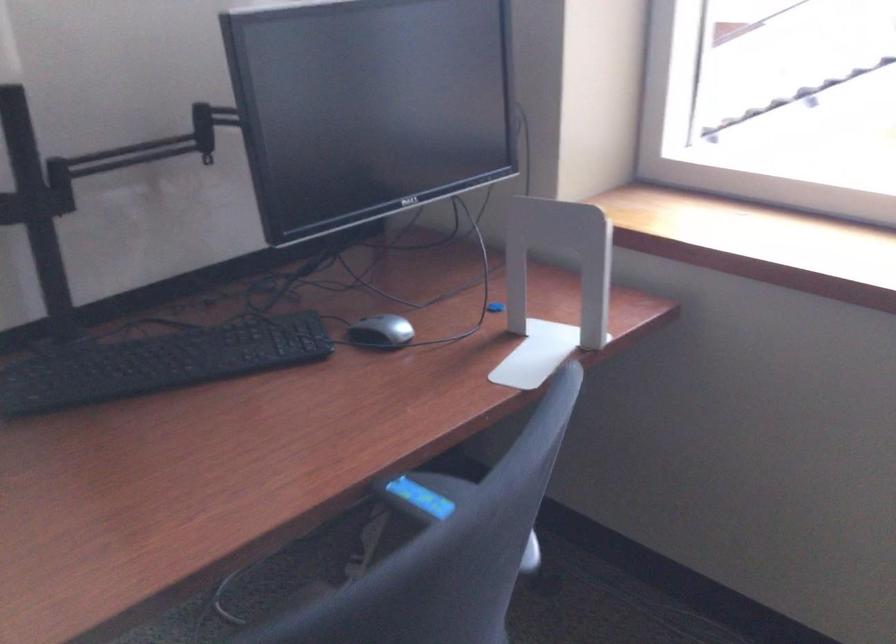
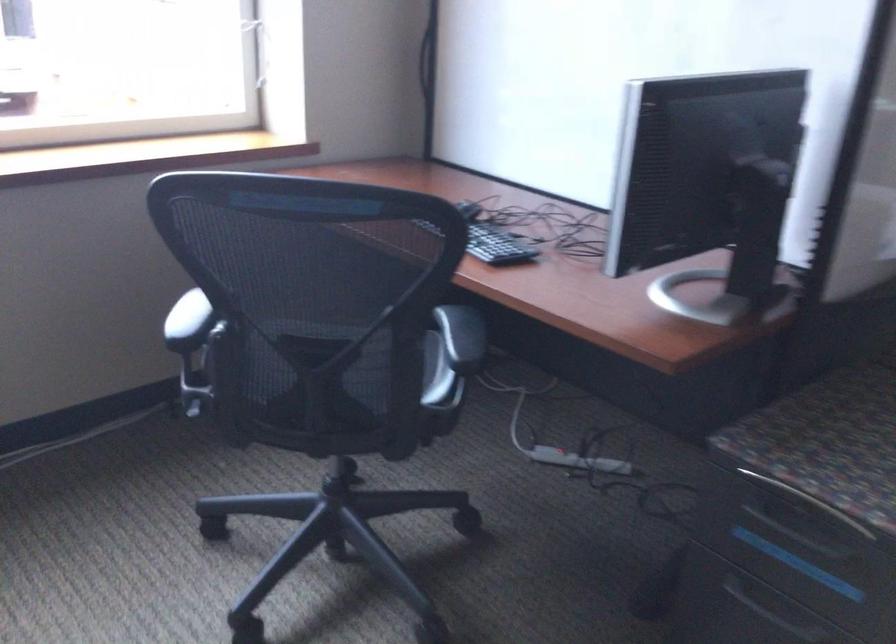
Question: I am providing you with two images of the same scene from different viewpoints. Please identify which objects are invisible in image2.

Choices:
 (A) silver computer mouse
 (B) power strip switch
 (C) black keyboard
 (D) cardboard food box

Answer: (A)